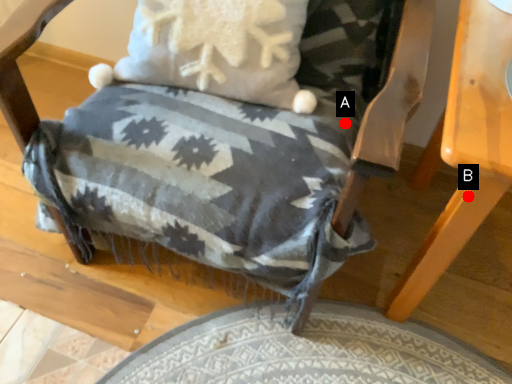
Question: Two points are circled on the image, labeled by A and B beside each circle. Which point is farther from the camera taking this photo?

Choices:
 (A) A is further
 (B) B is further

Answer: (A)